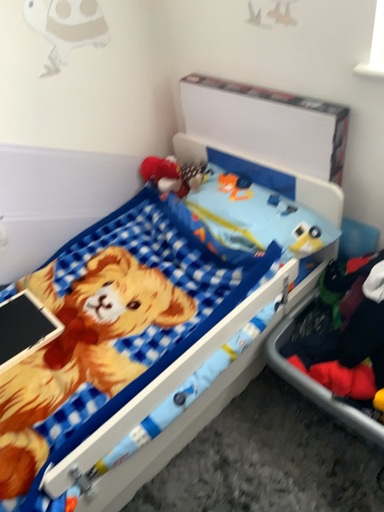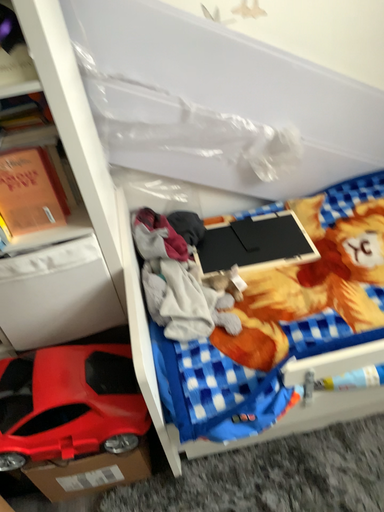
Question: How did the camera likely rotate when shooting the video?

Choices:
 (A) rotated left
 (B) rotated right

Answer: (A)